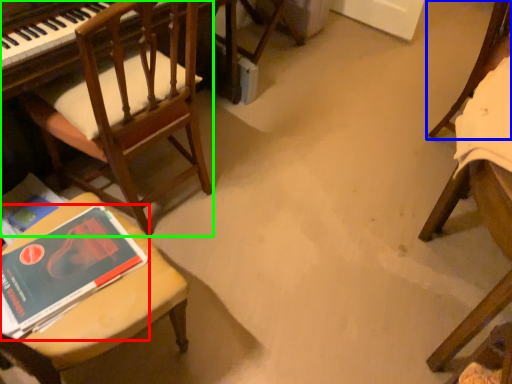
Question: Which is farther away from book (highlighted by a red box)? chair (highlighted by a blue box) or chair (highlighted by a green box)?

Choices:
 (A) chair
 (B) chair

Answer: (A)